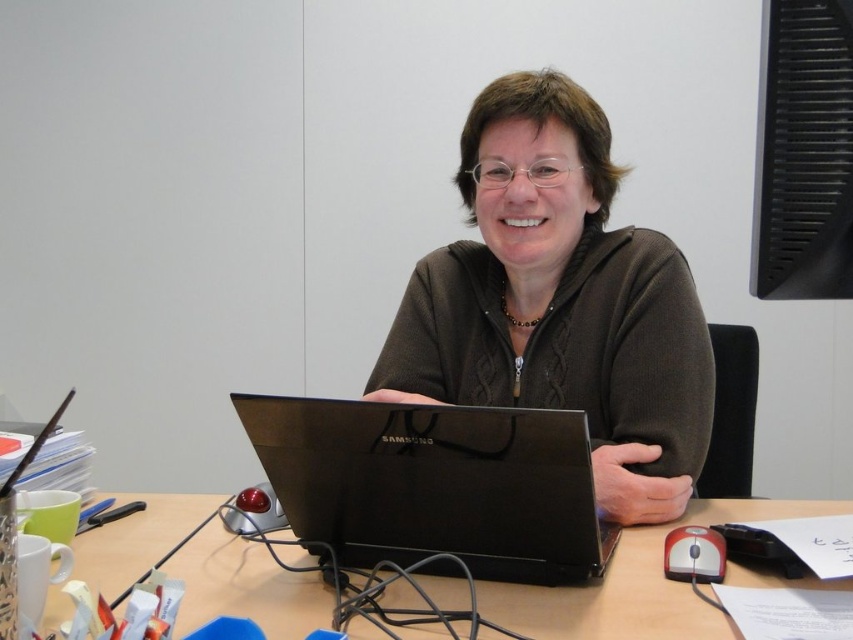
Where is the black matte laptop at center located in the image?

The black matte laptop at center is located at point coordinates of (x=434, y=484).

You are organizing the desk and need to place a new item between the brown sweater at center and the wooden table at center. Is there enough space between them to fit a 10 cm wide notebook?

The brown sweater at center is positioned on the right side of the wooden table at center. Since the sweater is on the right of the table, there is space between them. However, the description does not provide the exact distance between them, so it is unclear if a 10 cm wide notebook would fit. More information about the distance is needed to determine this.